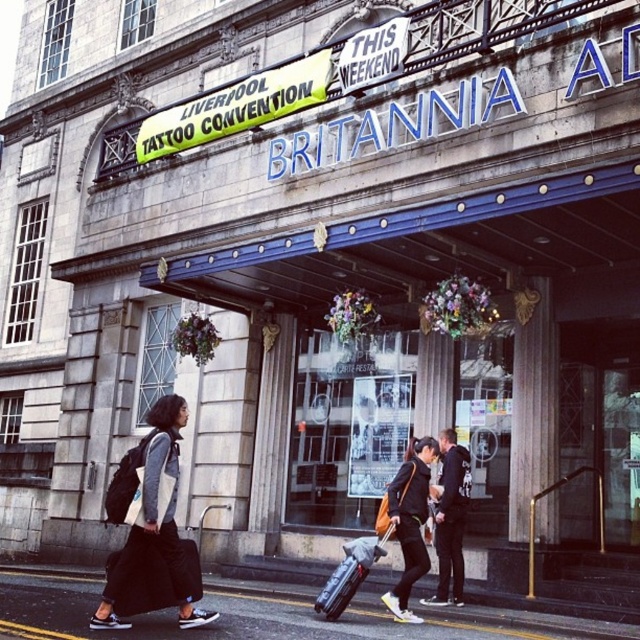
Question: Is matte black jacket at center closer to camera compared to dark gray jacket at center?

Choices:
 (A) no
 (B) yes

Answer: (B)

Question: Which object appears closest to the camera in this image?

Choices:
 (A) matte black jacket at center
 (B) matte black suitcase at center
 (C) dark gray jacket at center
 (D) smooth asphalt pavement at lower center

Answer: (D)

Question: Which point is closer to the camera?

Choices:
 (A) (218, 627)
 (B) (344, 582)

Answer: (A)

Question: Is matte black backpack at left positioned behind matte black suitcase at center?

Choices:
 (A) no
 (B) yes

Answer: (A)

Question: Does smooth asphalt pavement at lower center appear under matte black suitcase at center?

Choices:
 (A) no
 (B) yes

Answer: (B)

Question: Estimate the real-world distances between objects in this image. Which object is closer to the matte black suitcase at center?

Choices:
 (A) matte black jacket at center
 (B) smooth asphalt pavement at lower center

Answer: (A)